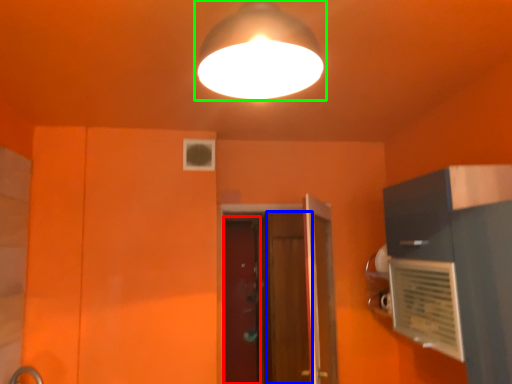
Question: Considering the real-world distances, which object is closest to screen door (highlighted by a red box)? screen door (highlighted by a blue box) or lamp (highlighted by a green box).

Choices:
 (A) screen door
 (B) lamp

Answer: (A)